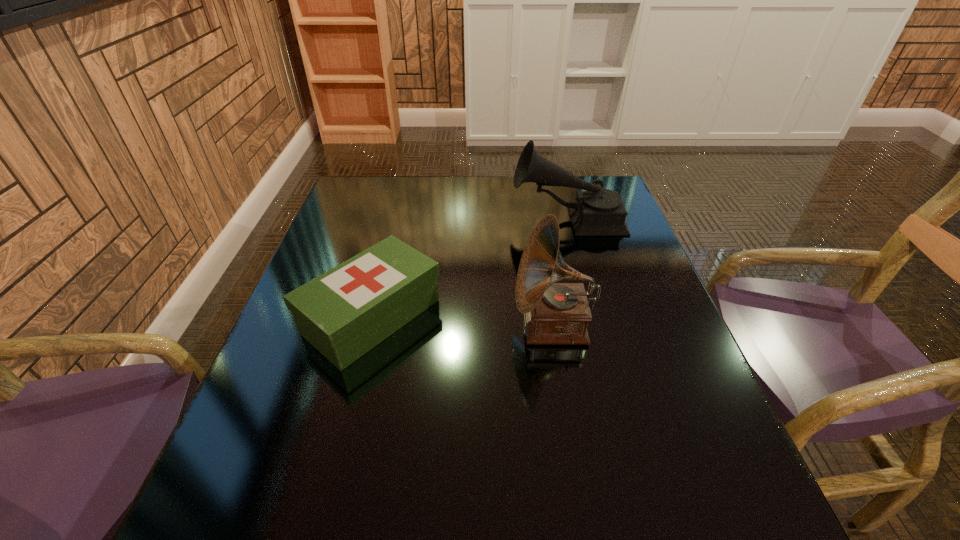
You are a GUI agent. You are given a task and a screenshot of the screen. Output one action in this format:
    pyautogui.click(x=<x>, y=<y>)
    Task: Click on the nearer phonograph_record
    The image size is (960, 540).
    Given the screenshot: What is the action you would take?
    pyautogui.click(x=554, y=313)

The height and width of the screenshot is (540, 960). What are the coordinates of `the second shortest object` in the screenshot? It's located at (597, 211).

The image size is (960, 540). What are the coordinates of `the farther phonograph_record` in the screenshot? It's located at (597, 211).

I want to click on the leftmost object, so click(345, 312).

I want to click on the first-aid kit, so click(345, 312).

Locate an element on the screen. vacant region located on the horn of the nearer phonograph_record is located at coordinates [x=335, y=326].

At what (x,y) coordinates should I click in order to perform the action: click on vacant space located on the horn of the nearer phonograph_record. Please return your answer as a coordinate pair (x, y). Looking at the image, I should click on (348, 326).

Where is `free spot located on the horn of the nearer phonograph_record`? free spot located on the horn of the nearer phonograph_record is located at coordinates (344, 326).

At what (x,y) coordinates should I click in order to perform the action: click on vacant space located 0.390m from the horn of the second shortest object. Please return your answer as a coordinate pair (x, y). Looking at the image, I should click on (377, 218).

Locate an element on the screen. This screenshot has height=540, width=960. free region located 0.080m from the horn of the second shortest object is located at coordinates (484, 218).